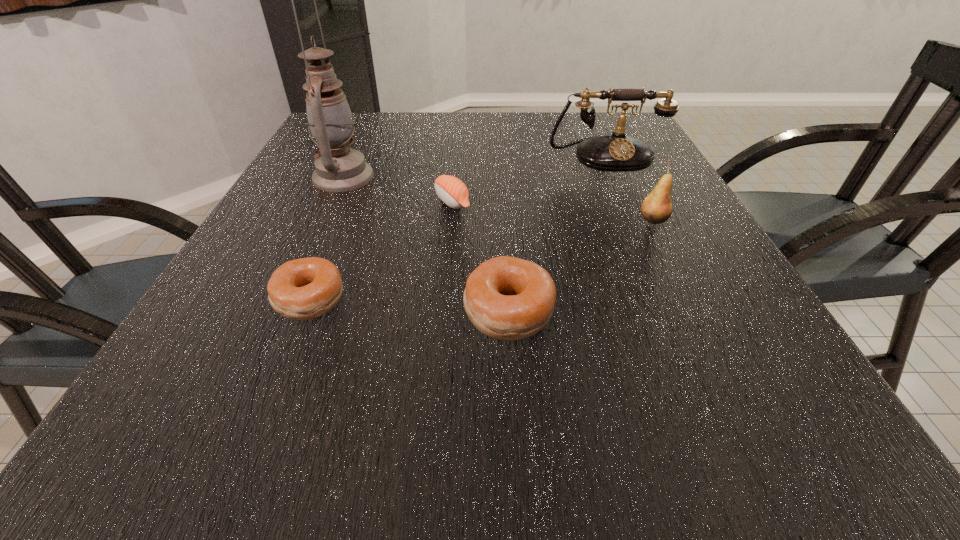
All bagels are currently evenly spaced. To continue this pattern, where would you add another bagel on the right? Please point out a vacant spot. Please provide its 2D coordinates. Your answer should be formatted as a tuple, i.e. [(x, y)], where the tuple contains the x and y coordinates of a point satisfying the conditions above.

[(718, 323)]